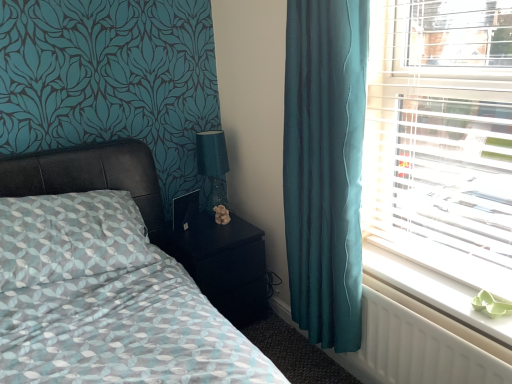
Question: From a real-world perspective, is white plastic radiator at lower right below teal glass table lamp at upper right?

Choices:
 (A) no
 (B) yes

Answer: (B)

Question: Is teal glass table lamp at upper right surrounded by white plastic radiator at lower right?

Choices:
 (A) yes
 (B) no

Answer: (B)

Question: Can you see white plastic radiator at lower right touching teal glass table lamp at upper right?

Choices:
 (A) no
 (B) yes

Answer: (A)

Question: Can you confirm if white plastic radiator at lower right is bigger than teal glass table lamp at upper right?

Choices:
 (A) no
 (B) yes

Answer: (A)

Question: Is white plastic radiator at lower right positioned beyond the bounds of teal glass table lamp at upper right?

Choices:
 (A) no
 (B) yes

Answer: (B)

Question: Does point (435, 380) appear closer or farther from the camera than point (78, 347)?

Choices:
 (A) closer
 (B) farther

Answer: (B)

Question: In the image, is white plastic radiator at lower right on the left side or the right side of matte black bed at left?

Choices:
 (A) left
 (B) right

Answer: (B)

Question: Looking at their shapes, would you say white plastic radiator at lower right is wider or thinner than matte black bed at left?

Choices:
 (A) thin
 (B) wide

Answer: (A)

Question: From a real-world perspective, relative to matte black bed at left, is white plastic radiator at lower right vertically above or below?

Choices:
 (A) above
 (B) below

Answer: (B)

Question: Relative to white plastic radiator at lower right, is matte black bed at left in front or behind?

Choices:
 (A) behind
 (B) front

Answer: (B)

Question: Would you say matte black bed at left is to the left or to the right of white plastic radiator at lower right in the picture?

Choices:
 (A) right
 (B) left

Answer: (B)

Question: From the image's perspective, is matte black bed at left above or below white plastic radiator at lower right?

Choices:
 (A) above
 (B) below

Answer: (A)

Question: Considering the positions of point (203, 314) and point (446, 294), is point (203, 314) closer or farther from the camera than point (446, 294)?

Choices:
 (A) farther
 (B) closer

Answer: (B)

Question: Considering the relative positions of matte black bed at left and white plastic blinds at right in the image provided, is matte black bed at left to the left or to the right of white plastic blinds at right?

Choices:
 (A) left
 (B) right

Answer: (A)

Question: From a real-world perspective, relative to white plastic blinds at right, is matte black bed at left vertically above or below?

Choices:
 (A) below
 (B) above

Answer: (A)